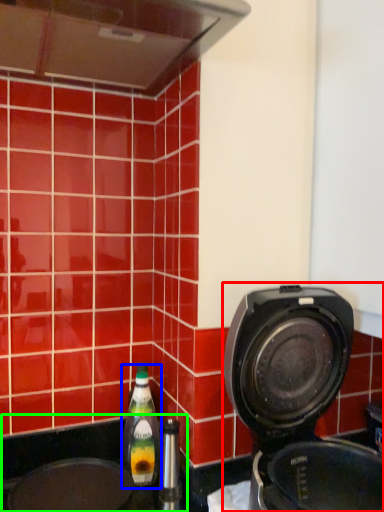
Question: Considering the real-world distances, which object is closest to home appliance (highlighted by a red box)? bottle (highlighted by a blue box) or sink (highlighted by a green box).

Choices:
 (A) bottle
 (B) sink

Answer: (B)